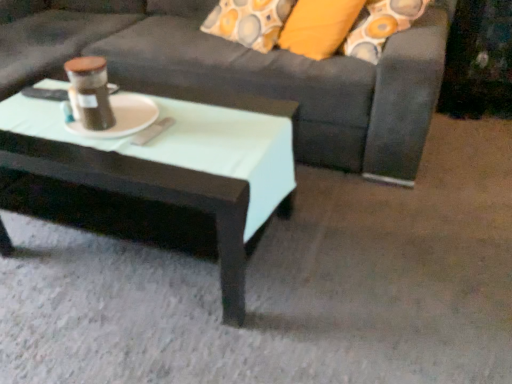
Question: From a real-world perspective, is dark gray fabric couch at center on top of white matte platter at center?

Choices:
 (A) no
 (B) yes

Answer: (A)

Question: Can you confirm if dark gray fabric couch at center is smaller than white matte platter at center?

Choices:
 (A) no
 (B) yes

Answer: (A)

Question: Considering the relative sizes of dark gray fabric couch at center and white matte platter at center in the image provided, is dark gray fabric couch at center taller than white matte platter at center?

Choices:
 (A) yes
 (B) no

Answer: (A)

Question: From the image's perspective, does dark gray fabric couch at center appear lower than white matte platter at center?

Choices:
 (A) no
 (B) yes

Answer: (A)

Question: Can you confirm if dark gray fabric couch at center is shorter than white matte platter at center?

Choices:
 (A) no
 (B) yes

Answer: (A)

Question: From a real-world perspective, is dark gray fabric couch at center positioned under white matte platter at center based on gravity?

Choices:
 (A) yes
 (B) no

Answer: (A)

Question: Considering the relative positions of white matte platter at center and dark gray fabric couch at center in the image provided, is white matte platter at center to the right of dark gray fabric couch at center from the viewer's perspective?

Choices:
 (A) yes
 (B) no

Answer: (A)

Question: Is white matte platter at center smaller than dark gray fabric couch at center?

Choices:
 (A) yes
 (B) no

Answer: (A)

Question: Is white matte platter at center next to dark gray fabric couch at center?

Choices:
 (A) no
 (B) yes

Answer: (A)

Question: From the image's perspective, would you say white matte platter at center is positioned over dark gray fabric couch at center?

Choices:
 (A) no
 (B) yes

Answer: (A)

Question: Could you tell me if white matte platter at center is turned towards dark gray fabric couch at center?

Choices:
 (A) yes
 (B) no

Answer: (A)

Question: Is white matte platter at center bigger than dark gray fabric couch at center?

Choices:
 (A) no
 (B) yes

Answer: (A)

Question: From the image's perspective, is matte black coffee table at center located beneath matte brown jar at center?

Choices:
 (A) yes
 (B) no

Answer: (A)